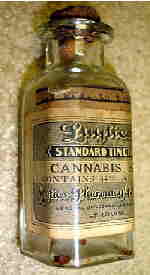
The height and width of the screenshot is (275, 150). In order to click on bottle in this screenshot , I will do `click(94, 247)`.